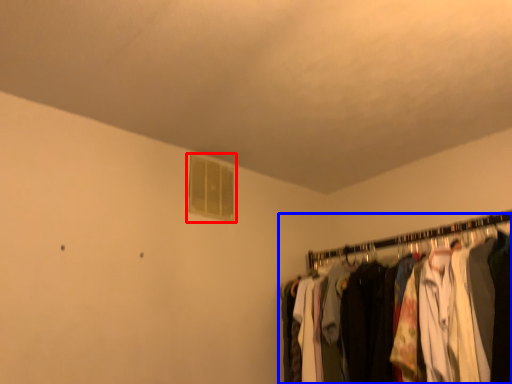
Question: Among these objects, which one is nearest to the camera, window (highlighted by a red box) or closet (highlighted by a blue box)?

Choices:
 (A) window
 (B) closet

Answer: (B)